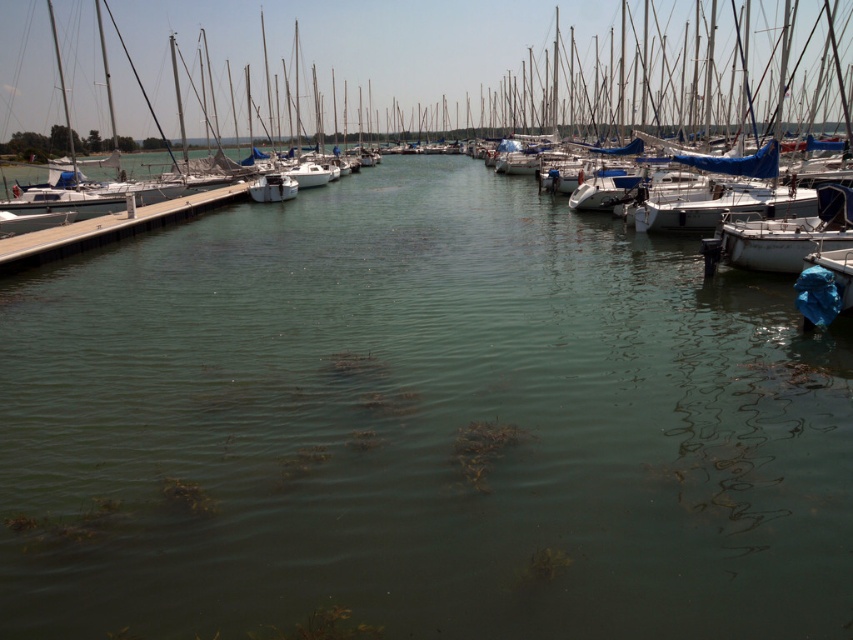
Does smooth wooden dock at left appear under white matte boat at center?

Yes, smooth wooden dock at left is below white matte boat at center.

What do you see at coordinates (107, 228) in the screenshot? I see `smooth wooden dock at left` at bounding box center [107, 228].

Identify the location of smooth wooden dock at left. (107, 228).